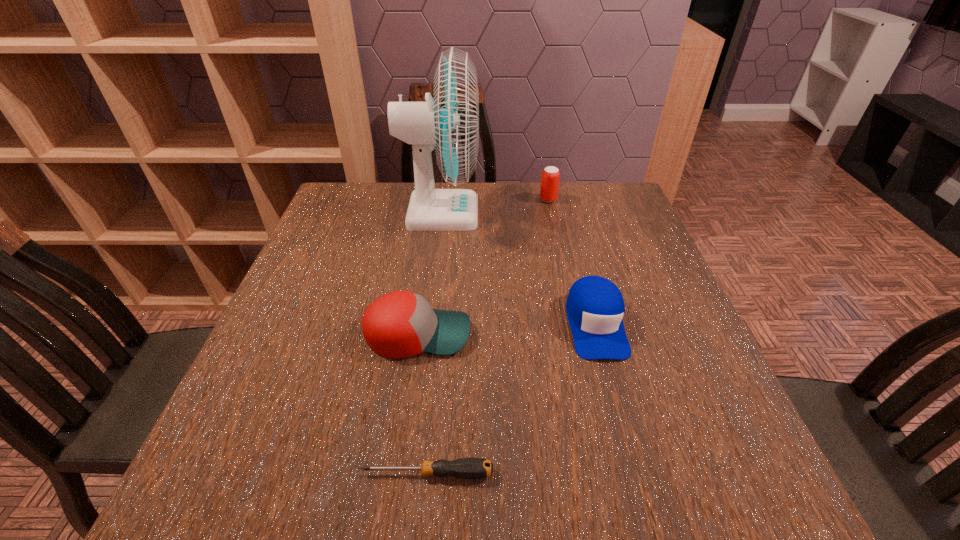
Where is `the third closest object relative to the nearest object`? This screenshot has height=540, width=960. the third closest object relative to the nearest object is located at coordinates (449, 123).

In order to click on object identified as the second closest to the right baseball cap in this screenshot , I will do `click(449, 123)`.

At what (x,y) coordinates should I click in order to perform the action: click on free space that satisfies the following two spatial constraints: 1. on the back side of the screwdriver; 2. at the brim of the left baseball cap. Please return your answer as a coordinate pair (x, y). The height and width of the screenshot is (540, 960). Looking at the image, I should click on (441, 334).

Find the location of a particular element. This screenshot has height=540, width=960. free region that satisfies the following two spatial constraints: 1. in front of the fan to face the airflow; 2. on the back side of the screwdriver is located at coordinates (409, 474).

Where is `vacant space that satisfies the following two spatial constraints: 1. in front of the fan to face the airflow; 2. on the back side of the shortest object`? vacant space that satisfies the following two spatial constraints: 1. in front of the fan to face the airflow; 2. on the back side of the shortest object is located at coordinates (409, 474).

Locate an element on the screen. vacant position in the image that satisfies the following two spatial constraints: 1. at the brim of the left baseball cap; 2. on the back side of the nearest object is located at coordinates (398, 474).

You are a GUI agent. You are given a task and a screenshot of the screen. Output one action in this format:
    pyautogui.click(x=<x>, y=<y>)
    Task: Click on the vacant space that satisfies the following two spatial constraints: 1. at the brim of the left baseball cap; 2. on the right side of the screwdriver
    The image size is (960, 540).
    Given the screenshot: What is the action you would take?
    pyautogui.click(x=398, y=474)